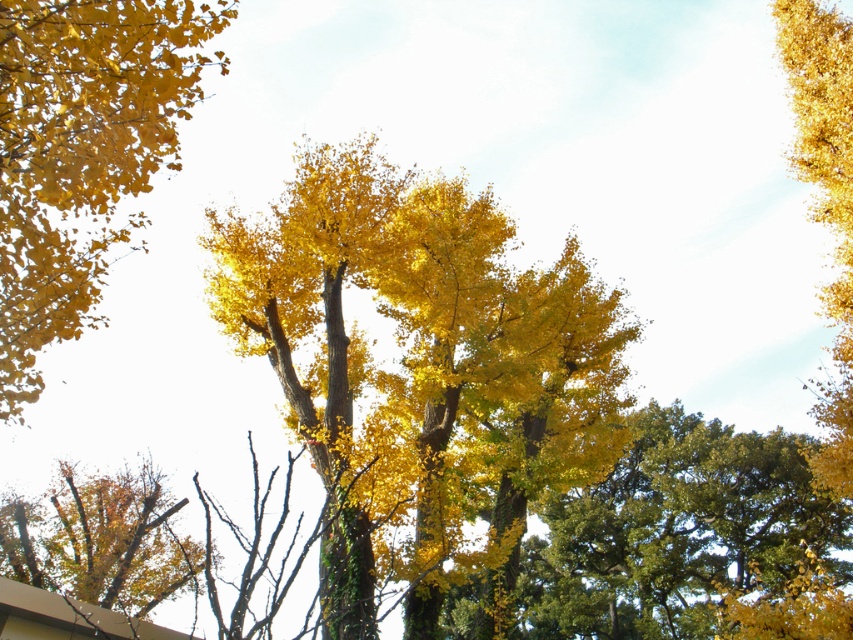
Question: Based on their relative distances, which object is nearer to the golden leafy tree at right?

Choices:
 (A) golden leafy tree at upper left
 (B) golden matte tree at center

Answer: (B)

Question: Is golden leafy tree at upper left thinner than yellow-green foliage at lower left?

Choices:
 (A) yes
 (B) no

Answer: (A)

Question: Which point appears farthest from the camera in this image?

Choices:
 (A) (444, 579)
 (B) (851, 248)

Answer: (B)

Question: Which is farther from the yellow-green foliage at lower left?

Choices:
 (A) golden matte tree at center
 (B) golden leafy tree at upper left

Answer: (A)

Question: Does golden leafy tree at upper left appear on the left side of golden leafy tree at right?

Choices:
 (A) yes
 (B) no

Answer: (A)

Question: Can you confirm if golden matte tree at center is positioned below golden leafy tree at right?

Choices:
 (A) yes
 (B) no

Answer: (A)